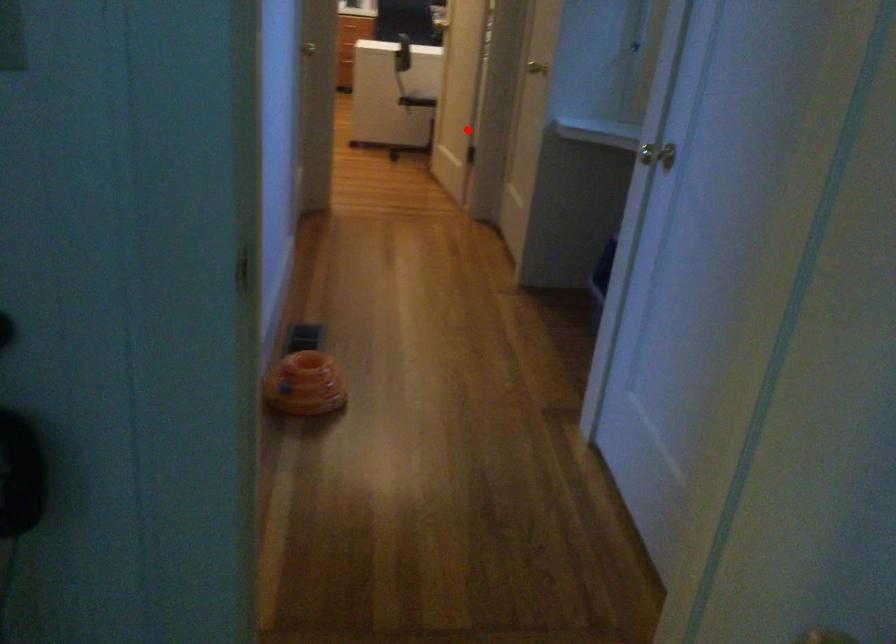
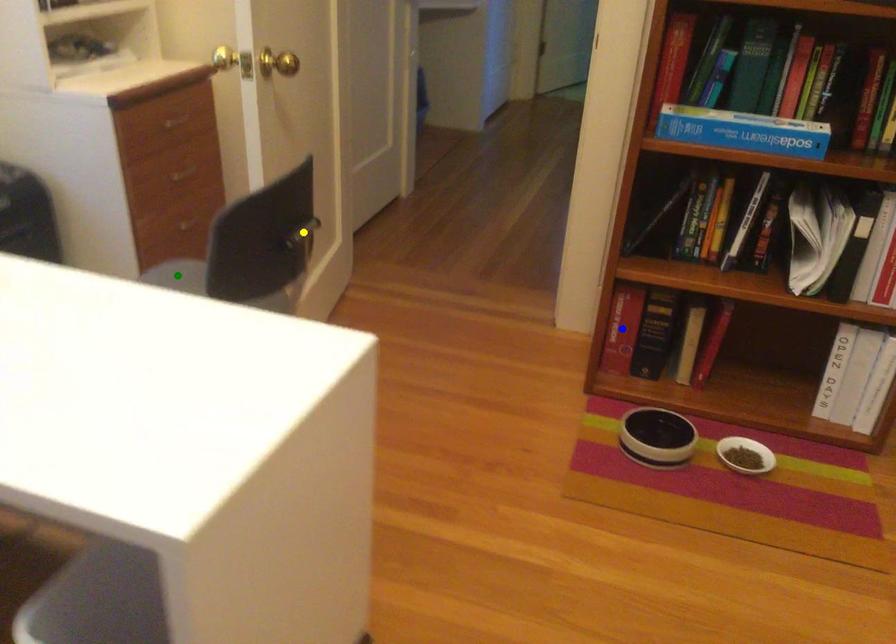
Question: I am providing you with two images of the same scene from different viewpoints. A red point is marked on the first image. You are given multiple points on the second image. Which spot in image 2 lines up with the point in image 1?

Choices:
 (A) yellow point
 (B) green point
 (C) blue point

Answer: (A)